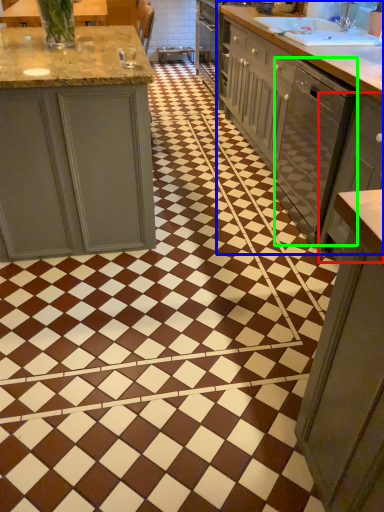
Question: Considering the real-world distances, which object is closest to cabinetry (highlighted by a red box)? countertop (highlighted by a blue box) or dish washer (highlighted by a green box).

Choices:
 (A) countertop
 (B) dish washer

Answer: (B)